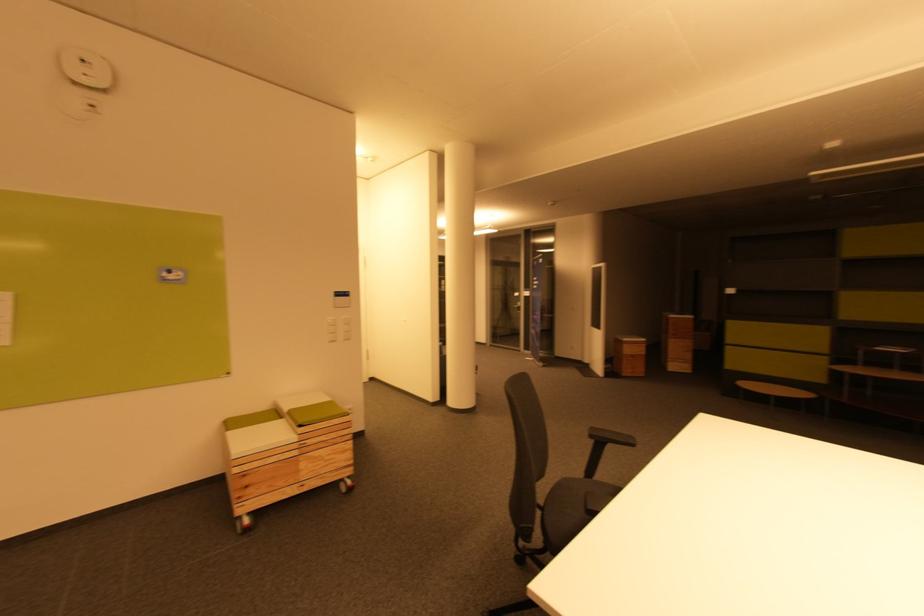
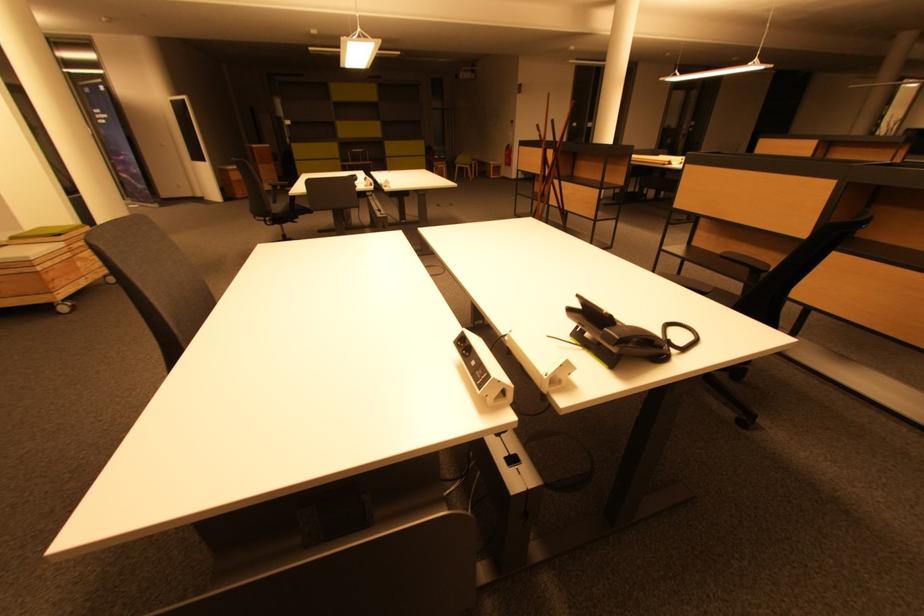
Where in the second image is the point corresponding to pixel 307 468 from the first image?

(83, 265)